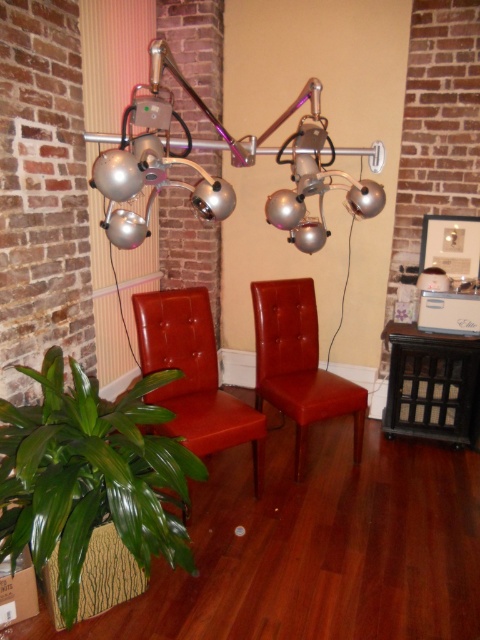
Between leather at left and leather at center, which one appears on the left side from the viewer's perspective?

leather at left is more to the left.

Which is more to the right, leather at left or leather at center?

Positioned to the right is leather at center.

Which is in front, point (137, 326) or point (269, 296)?

Positioned in front is point (137, 326).

This screenshot has height=640, width=480. I want to click on leather at left, so click(192, 376).

Can you confirm if green leafy plant at lower left is positioned to the left of leather at center?

Yes, green leafy plant at lower left is to the left of leather at center.

Is green leafy plant at lower left bigger than leather at center?

Yes, green leafy plant at lower left is bigger than leather at center.

Locate an element on the screen. green leafy plant at lower left is located at coordinates (x=91, y=476).

Is green leafy plant at lower left bigger than metallic silver lamp at upper center?

Incorrect, green leafy plant at lower left is not larger than metallic silver lamp at upper center.

Looking at this image, who is more forward, (167, 477) or (100, 184)?

Point (167, 477) is more forward.

The height and width of the screenshot is (640, 480). What do you see at coordinates (91, 476) in the screenshot? I see `green leafy plant at lower left` at bounding box center [91, 476].

At what (x,y) coordinates should I click in order to perform the action: click on green leafy plant at lower left. Please return your answer as a coordinate pair (x, y). Looking at the image, I should click on (91, 476).